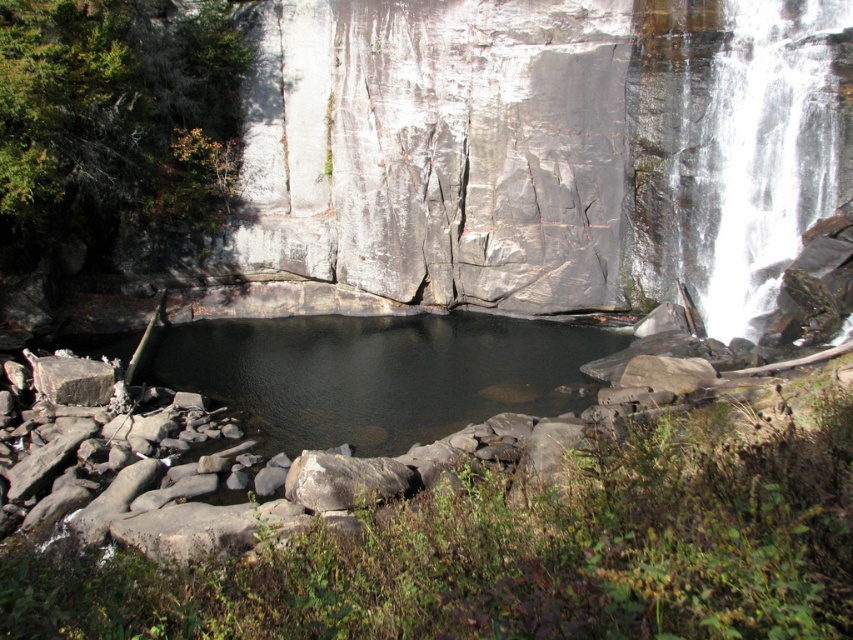
Question: Is white frothy water at upper right wider than gray rough stone at lower left?

Choices:
 (A) no
 (B) yes

Answer: (B)

Question: Which object is farther from the camera taking this photo?

Choices:
 (A) gray rough stone at lower left
 (B) gray rough rock at center

Answer: (A)

Question: Among these objects, which one is nearest to the camera?

Choices:
 (A) white frothy water at upper right
 (B) dark gray water at center
 (C) gray rough rock at center

Answer: (C)

Question: Can you confirm if dark gray water at center is positioned to the left of gray rough stone at lower left?

Choices:
 (A) no
 (B) yes

Answer: (A)

Question: Does white frothy water at upper right have a smaller size compared to dark gray water at center?

Choices:
 (A) no
 (B) yes

Answer: (B)

Question: Which point appears closest to the camera in this image?

Choices:
 (A) 107,388
 (B) 364,483
 (C) 415,388

Answer: (B)